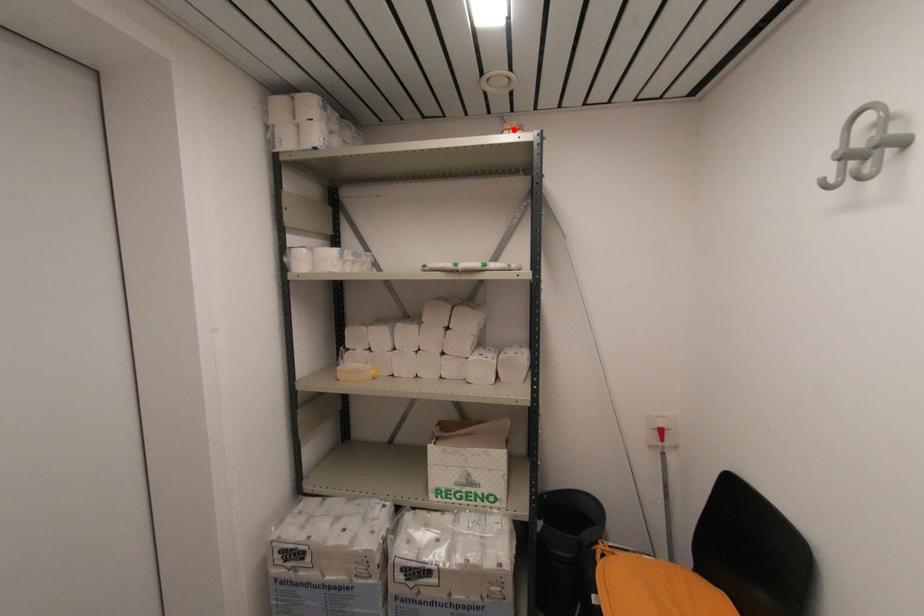
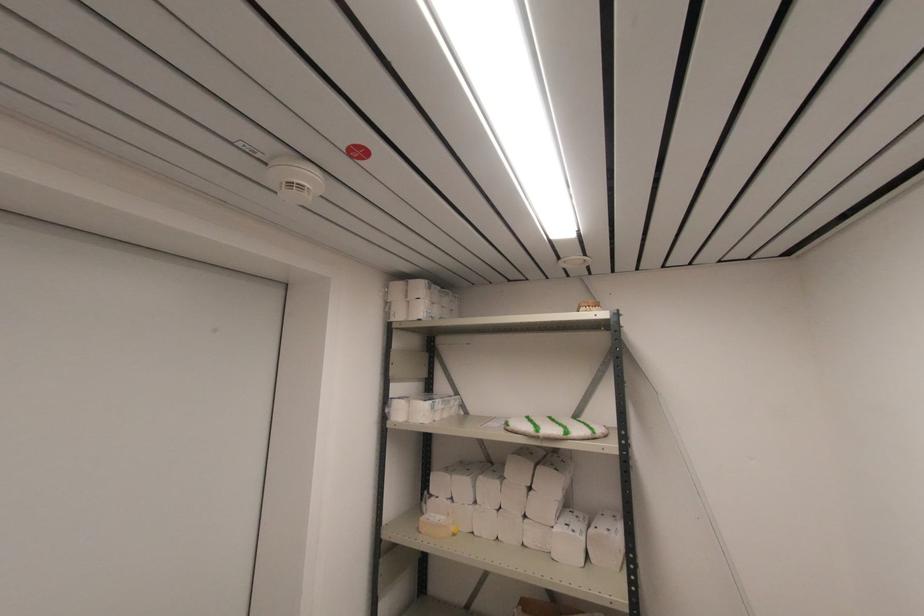
Locate, in the second image, the point that corresponds to the highlighted location in the first image.

(590, 307)